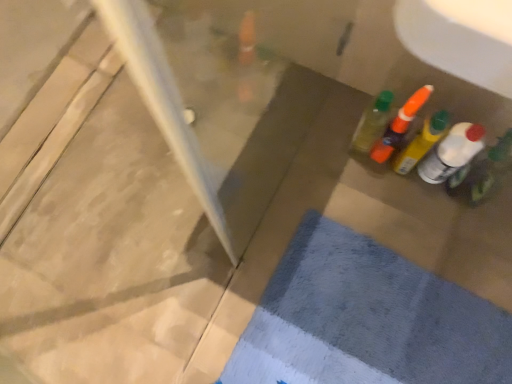
Question: Can you confirm if translucent plastic bottle at right, positioned as the second bottle in right-to-left order, is bigger than blue textured bath mat at lower right?

Choices:
 (A) yes
 (B) no

Answer: (B)

Question: Is the position of translucent plastic bottle at right, positioned as the second bottle in right-to-left order, more distant than that of blue textured bath mat at lower right?

Choices:
 (A) yes
 (B) no

Answer: (B)

Question: From the image's perspective, would you say translucent plastic bottle at right, positioned as the second bottle in right-to-left order, is shown under blue textured bath mat at lower right?

Choices:
 (A) no
 (B) yes

Answer: (A)

Question: From a real-world perspective, is translucent plastic bottle at right, positioned as the second bottle in right-to-left order, on top of blue textured bath mat at lower right?

Choices:
 (A) no
 (B) yes

Answer: (B)

Question: Is blue textured bath mat at lower right at the back of translucent plastic bottle at right, positioned as the second bottle in right-to-left order?

Choices:
 (A) yes
 (B) no

Answer: (B)

Question: From a real-world perspective, is blue textured bath mat at lower right above or below translucent plastic bottle at right, which ranks as the first bottle in right-to-left order?

Choices:
 (A) below
 (B) above

Answer: (A)

Question: In the image, is blue textured bath mat at lower right on the left side or the right side of translucent plastic bottle at right, which ranks as the first bottle in right-to-left order?

Choices:
 (A) left
 (B) right

Answer: (A)

Question: Choose the correct answer: Is blue textured bath mat at lower right inside translucent plastic bottle at right, the fourth bottle positioned from the left, or outside it?

Choices:
 (A) inside
 (B) outside

Answer: (B)

Question: Looking at the image, does blue textured bath mat at lower right seem bigger or smaller compared to translucent plastic bottle at right, which ranks as the first bottle in right-to-left order?

Choices:
 (A) small
 (B) big

Answer: (B)

Question: Is translucent plastic bottle at right, positioned as the second bottle in right-to-left order, in front of or behind translucent orange bottle at upper right, the 3th bottle when ordered from right to left, in the image?

Choices:
 (A) front
 (B) behind

Answer: (A)

Question: In terms of height, does translucent plastic bottle at right, positioned as the second bottle in right-to-left order, look taller or shorter compared to translucent orange bottle at upper right, the second bottle when ordered from left to right?

Choices:
 (A) tall
 (B) short

Answer: (B)

Question: Would you say translucent plastic bottle at right, the third bottle in the left-to-right sequence, is inside or outside translucent orange bottle at upper right, the second bottle when ordered from left to right?

Choices:
 (A) outside
 (B) inside

Answer: (A)

Question: From a real-world perspective, is translucent plastic bottle at right, the third bottle in the left-to-right sequence, physically located above or below translucent orange bottle at upper right, the second bottle when ordered from left to right?

Choices:
 (A) below
 (B) above

Answer: (B)

Question: Visually, is translucent plastic bottle at right, which ranks as the first bottle in right-to-left order, positioned to the left or to the right of blue textured bath mat at lower right?

Choices:
 (A) left
 (B) right

Answer: (B)

Question: From the image's perspective, is translucent plastic bottle at right, the fourth bottle positioned from the left, above or below blue textured bath mat at lower right?

Choices:
 (A) above
 (B) below

Answer: (A)